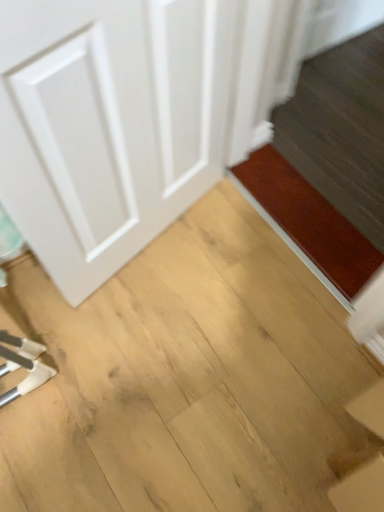
Question: In the image, is brown matte doormat at lower right positioned in front of or behind light brown wood at center?

Choices:
 (A) front
 (B) behind

Answer: (B)

Question: Is point [x=274, y=159] closer or farther from the camera than point [x=244, y=410]?

Choices:
 (A) farther
 (B) closer

Answer: (A)

Question: Estimate the real-world distances between objects in this image. Which object is farther from the brown matte doormat at lower right?

Choices:
 (A) light brown wood at center
 (B) white matte door at left

Answer: (B)

Question: Which object is positioned closest to the brown matte doormat at lower right?

Choices:
 (A) light brown wood at center
 (B) white matte door at left

Answer: (A)